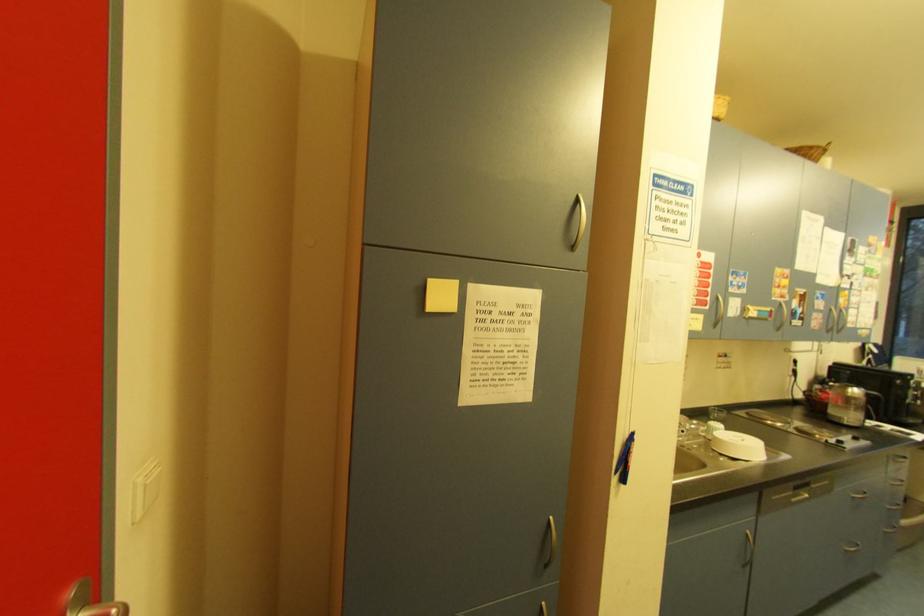
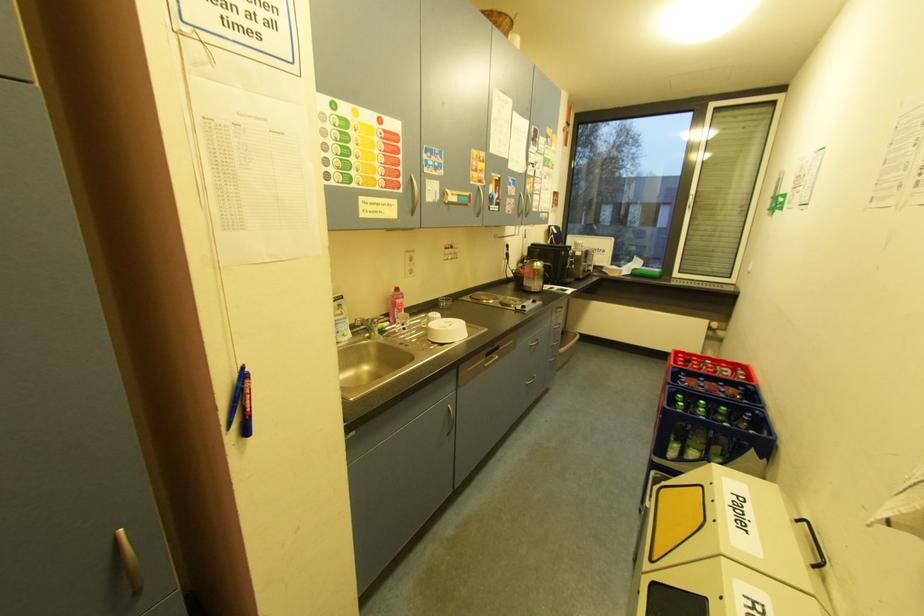
First-person continuous shooting, in which direction is the camera rotating?

The camera's rotation is toward right-down.